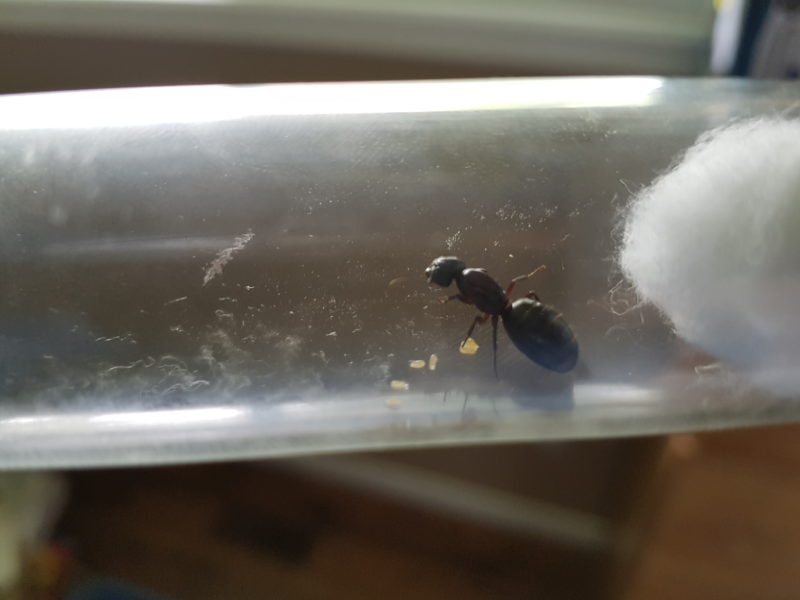
I want to click on white light, so click(234, 116).